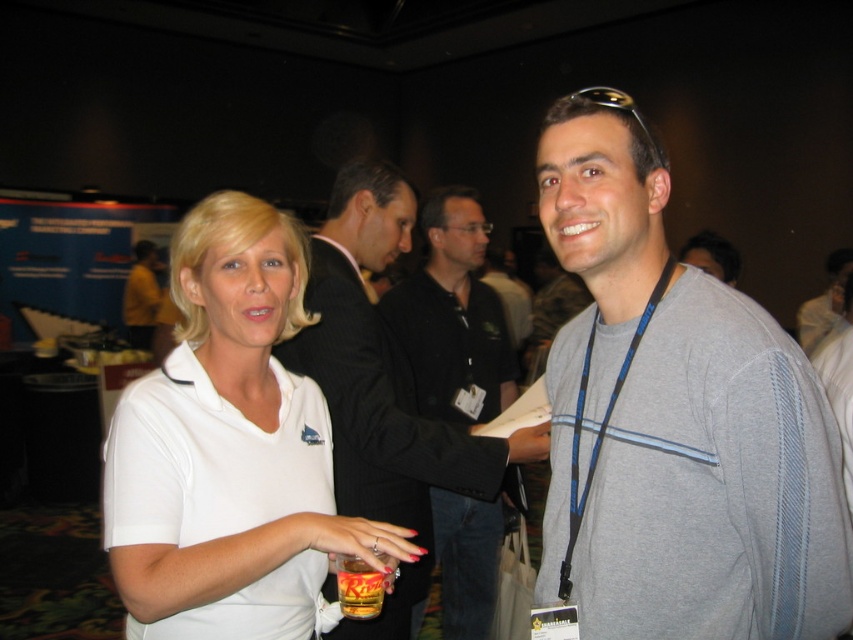
In the image of the social gathering, there is a white matte shirt at center and a golden amber glass at lower center. Which object is positioned to the left?

The white matte shirt at center is to the left of the golden amber glass at lower center.

You are a photographer at a conference. You need to capture a group photo of two people wearing gray fabric shirt at center and white matte shirt at center. Since you want to highlight both equally, which shirt should you adjust the camera focus to ensure both are visible?

The gray fabric shirt at center is smaller than the white matte shirt at center. To ensure both are visible, focus on the white matte shirt at center since it is larger and will occupy more space in the frame.

You are a photographer at this event. You need to capture a closeup shot of both the gray fabric shirt at center and the white matte shirt at center in a single frame. Given that your camera has a focal length of 50mm and a sensor size that allows for a maximum subject distance of 18 inches, will you be able to achieve this shot?

The distance between the gray fabric shirt at center and the white matte shirt at center is 16.30 inches, which is within the camera sensor maximum subject distance of 18 inches. Therefore, the photographer can capture both shirts in a single frame.